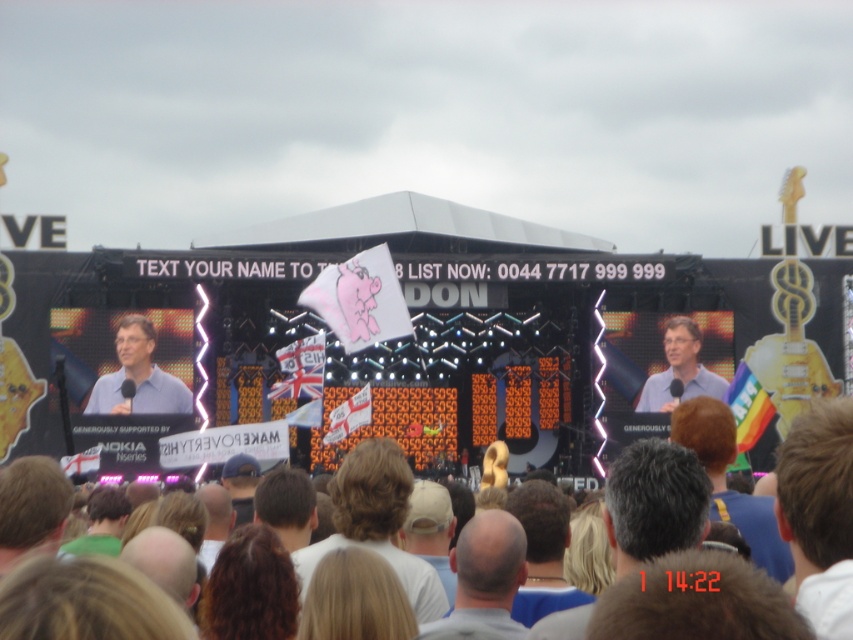
Can you confirm if bald head at center is positioned to the right of light blue shirt at center?

Incorrect, bald head at center is not on the right side of light blue shirt at center.

This screenshot has height=640, width=853. What do you see at coordinates (486, 573) in the screenshot? I see `bald head at center` at bounding box center [486, 573].

Locate an element on the screen. bald head at center is located at coordinates (486, 573).

Can you confirm if matte blue shirt at left is positioned below light blue shirt at center?

Yes.

The image size is (853, 640). Identify the location of matte blue shirt at left. (138, 376).

At what (x,y) coordinates should I click in order to perform the action: click on matte blue shirt at left. Please return your answer as a coordinate pair (x, y). The image size is (853, 640). Looking at the image, I should click on (138, 376).

Looking at this image, can you confirm if bald head at center is positioned below matte blue shirt at left?

Yes.

What do you see at coordinates (486, 573) in the screenshot? This screenshot has width=853, height=640. I see `bald head at center` at bounding box center [486, 573].

Image resolution: width=853 pixels, height=640 pixels. In order to click on bald head at center in this screenshot , I will do `click(486, 573)`.